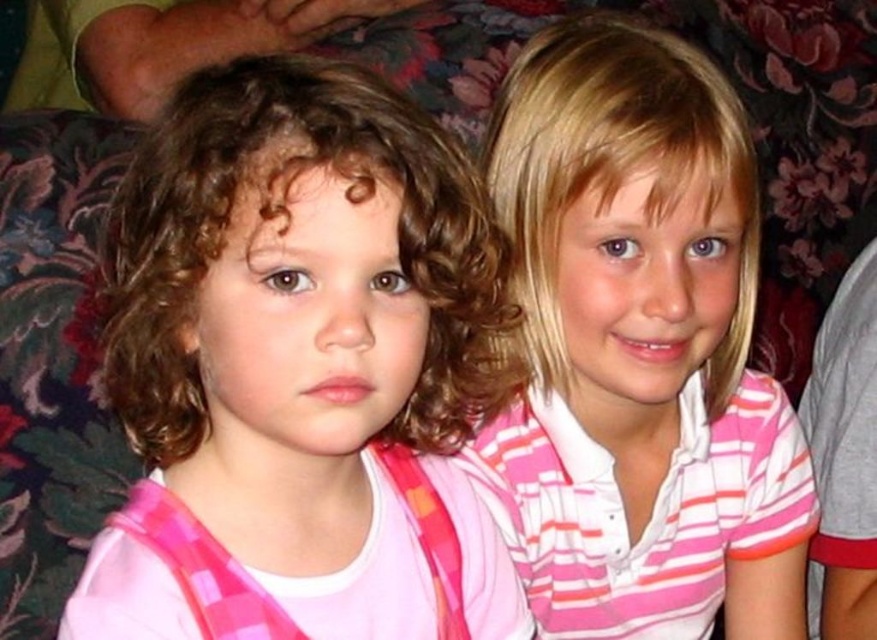
Question: Which of the following is the closest to the observer?

Choices:
 (A) pink striped shirt at upper right
 (B) pink plaid shirt at left

Answer: (B)

Question: Can you confirm if pink plaid shirt at left is thinner than pink striped shirt at upper right?

Choices:
 (A) yes
 (B) no

Answer: (A)

Question: Which point appears farthest from the camera in this image?

Choices:
 (A) (266, 161)
 (B) (769, 465)

Answer: (B)

Question: Which point is closer to the camera?

Choices:
 (A) pink striped shirt at upper right
 (B) pink plaid shirt at left

Answer: (B)

Question: Is pink plaid shirt at left below pink striped shirt at upper right?

Choices:
 (A) yes
 (B) no

Answer: (B)

Question: Does pink plaid shirt at left come in front of pink striped shirt at upper right?

Choices:
 (A) no
 (B) yes

Answer: (B)